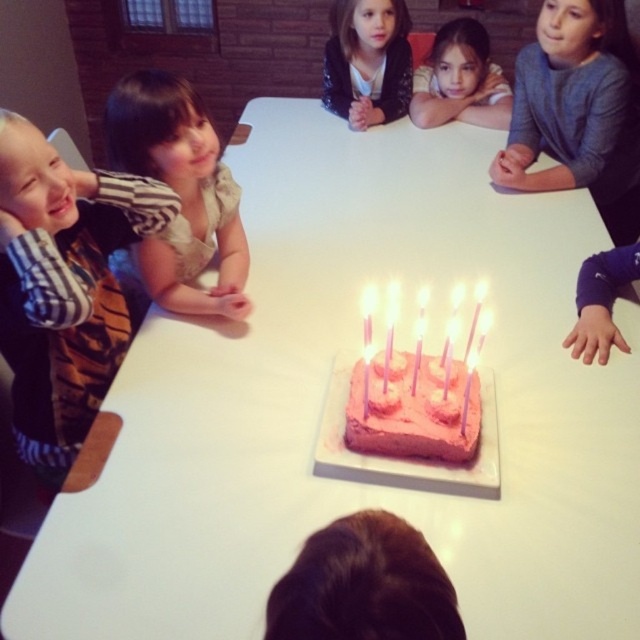
Does dark brown hair at lower center come behind pink frosted cake at center?

That is False.

The width and height of the screenshot is (640, 640). What do you see at coordinates (364, 586) in the screenshot?
I see `dark brown hair at lower center` at bounding box center [364, 586].

Locate an element on the screen. This screenshot has height=640, width=640. dark brown hair at lower center is located at coordinates (364, 586).

Is striped fabric shirt at left taller than matte pink cake at center?

Yes.

Between point (29, 348) and point (420, 80), which one is positioned in front?

Positioned in front is point (29, 348).

Is point (172, 218) less distant than point (460, 108)?

Yes, point (172, 218) is closer to viewer.

The height and width of the screenshot is (640, 640). I want to click on striped fabric shirt at left, so click(x=64, y=285).

Does striped fabric shirt at left have a larger size compared to dark brown hair at lower center?

Indeed, striped fabric shirt at left has a larger size compared to dark brown hair at lower center.

Between striped fabric shirt at left and dark brown hair at lower center, which one is positioned lower?

Positioned lower is dark brown hair at lower center.

Identify the location of striped fabric shirt at left. The width and height of the screenshot is (640, 640). (64, 285).

You are a GUI agent. You are given a task and a screenshot of the screen. Output one action in this format:
    pyautogui.click(x=<x>, y=<y>)
    Task: Click on the striped fabric shirt at left
    Image resolution: width=640 pixels, height=640 pixels.
    Given the screenshot: What is the action you would take?
    pyautogui.click(x=64, y=285)